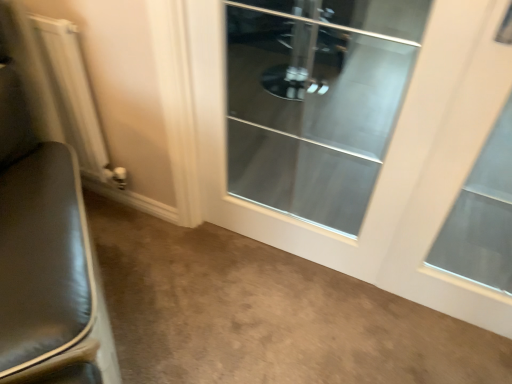
Question: Is clear glass door at center looking in the opposite direction of clear glass door at center?

Choices:
 (A) no
 (B) yes

Answer: (B)

Question: Does clear glass door at center have a lesser width compared to clear glass door at center?

Choices:
 (A) yes
 (B) no

Answer: (A)

Question: Are clear glass door at center and clear glass door at center located far from each other?

Choices:
 (A) yes
 (B) no

Answer: (B)

Question: From a real-world perspective, is clear glass door at center on top of clear glass door at center?

Choices:
 (A) yes
 (B) no

Answer: (A)

Question: Is clear glass door at center completely or partially inside clear glass door at center?

Choices:
 (A) yes
 (B) no

Answer: (B)

Question: From their relative heights in the image, would you say black leather chair at left is taller or shorter than white metallic radiator at left?

Choices:
 (A) short
 (B) tall

Answer: (B)

Question: Is black leather chair at left to the left or to the right of white metallic radiator at left in the image?

Choices:
 (A) right
 (B) left

Answer: (A)

Question: Relative to white metallic radiator at left, is black leather chair at left in front or behind?

Choices:
 (A) behind
 (B) front

Answer: (B)

Question: From the image's perspective, is black leather chair at left located above or below white metallic radiator at left?

Choices:
 (A) below
 (B) above

Answer: (A)

Question: From the image's perspective, is clear glass door at center positioned above or below white metallic radiator at left?

Choices:
 (A) below
 (B) above

Answer: (A)

Question: From a real-world perspective, is clear glass door at center above or below white metallic radiator at left?

Choices:
 (A) below
 (B) above

Answer: (B)

Question: Is clear glass door at center wider or thinner than white metallic radiator at left?

Choices:
 (A) thin
 (B) wide

Answer: (A)

Question: Is clear glass door at center bigger or smaller than white metallic radiator at left?

Choices:
 (A) small
 (B) big

Answer: (A)

Question: From the image's perspective, is clear glass door at center positioned above or below black leather chair at left?

Choices:
 (A) above
 (B) below

Answer: (A)

Question: In terms of width, does clear glass door at center look wider or thinner when compared to black leather chair at left?

Choices:
 (A) wide
 (B) thin

Answer: (B)